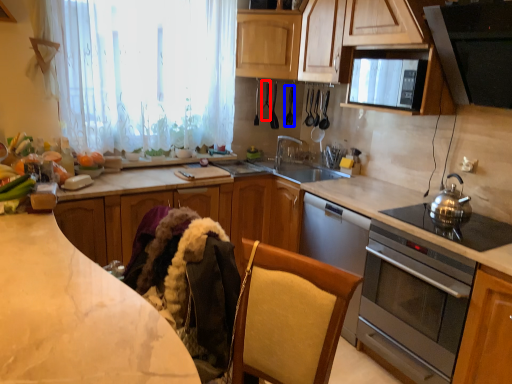
Question: Which object appears farthest to the camera in this image, appliance (highlighted by a red box) or appliance (highlighted by a blue box)?

Choices:
 (A) appliance
 (B) appliance

Answer: (A)